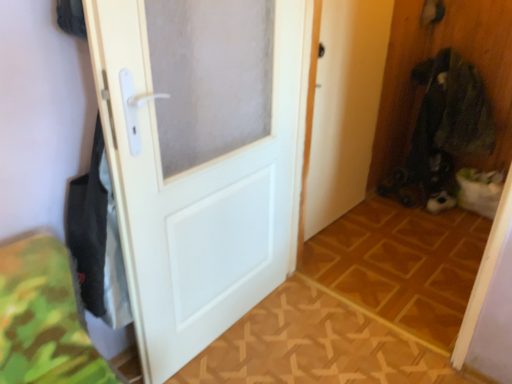
Question: Is dark green fabric at right positioned in front of white matte door at center?

Choices:
 (A) yes
 (B) no

Answer: (B)

Question: Is dark green fabric at right surrounding white matte door at center?

Choices:
 (A) no
 (B) yes

Answer: (A)

Question: Is dark green fabric at right to the left of white matte door at center from the viewer's perspective?

Choices:
 (A) no
 (B) yes

Answer: (A)

Question: Is dark green fabric at right positioned behind white matte door at center?

Choices:
 (A) no
 (B) yes

Answer: (B)

Question: Is dark green fabric at right taller than white matte door at center?

Choices:
 (A) yes
 (B) no

Answer: (B)

Question: Looking at their shapes, would you say wooden floor at center, which ranks as the second tile in front-to-back order, is wider or thinner than wooden parquet floor at center, the 2th tile in the back-to-front sequence?

Choices:
 (A) wide
 (B) thin

Answer: (A)

Question: From the image's perspective, relative to wooden parquet floor at center, the 2th tile in the back-to-front sequence, is wooden floor at center, which ranks as the second tile in front-to-back order, above or below?

Choices:
 (A) above
 (B) below

Answer: (A)

Question: Is point (461, 243) closer or farther from the camera than point (328, 302)?

Choices:
 (A) farther
 (B) closer

Answer: (A)

Question: In terms of size, does wooden floor at center, which ranks as the second tile in front-to-back order, appear bigger or smaller than wooden parquet floor at center, which is counted as the first tile, starting from the front?

Choices:
 (A) small
 (B) big

Answer: (B)

Question: Considering the positions of wooden parquet floor at center, the 2th tile in the back-to-front sequence, and white matte door at center in the image, is wooden parquet floor at center, the 2th tile in the back-to-front sequence, bigger or smaller than white matte door at center?

Choices:
 (A) small
 (B) big

Answer: (A)

Question: Is wooden parquet floor at center, the 2th tile in the back-to-front sequence, in front of or behind white matte door at center in the image?

Choices:
 (A) front
 (B) behind

Answer: (B)

Question: From their relative heights in the image, would you say wooden parquet floor at center, which is counted as the first tile, starting from the front, is taller or shorter than white matte door at center?

Choices:
 (A) tall
 (B) short

Answer: (B)

Question: Is wooden parquet floor at center, the 2th tile in the back-to-front sequence, to the left or to the right of white matte door at center in the image?

Choices:
 (A) right
 (B) left

Answer: (A)

Question: From a real-world perspective, is white matte door at center positioned above or below wooden parquet floor at center, which is counted as the first tile, starting from the front?

Choices:
 (A) above
 (B) below

Answer: (A)

Question: Is white matte door at center bigger or smaller than wooden parquet floor at center, which is counted as the first tile, starting from the front?

Choices:
 (A) big
 (B) small

Answer: (A)